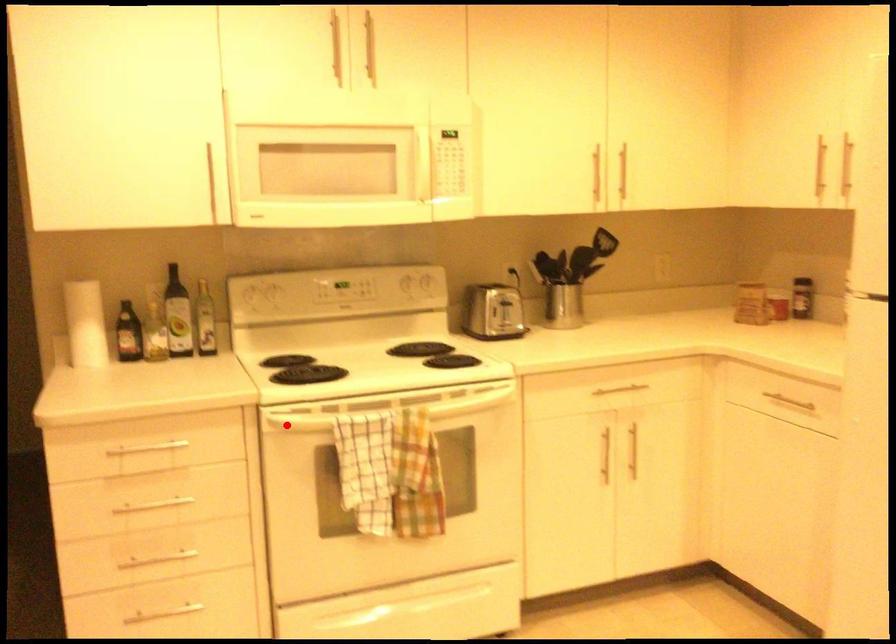
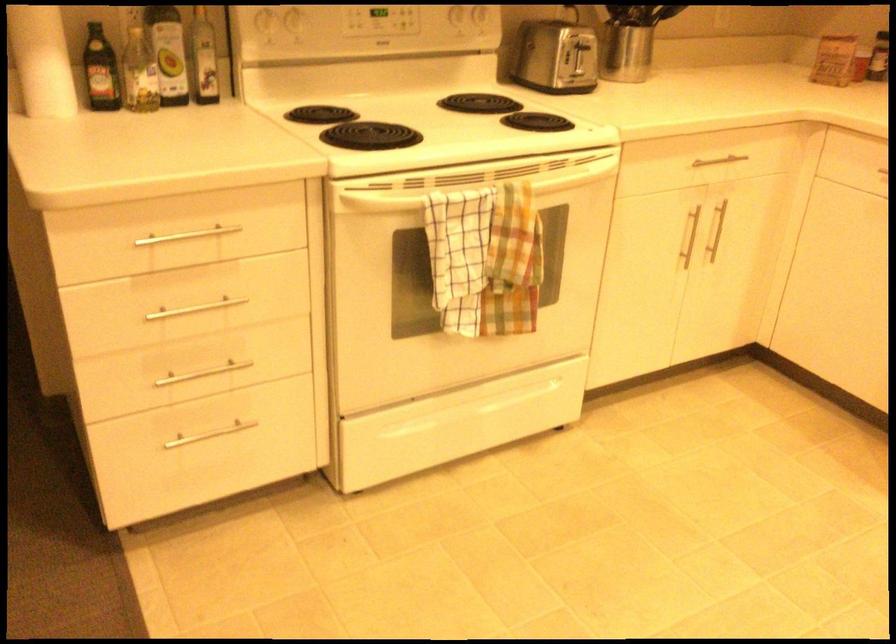
Locate, in the second image, the point that corresponds to the highlighted location in the first image.

(374, 202)